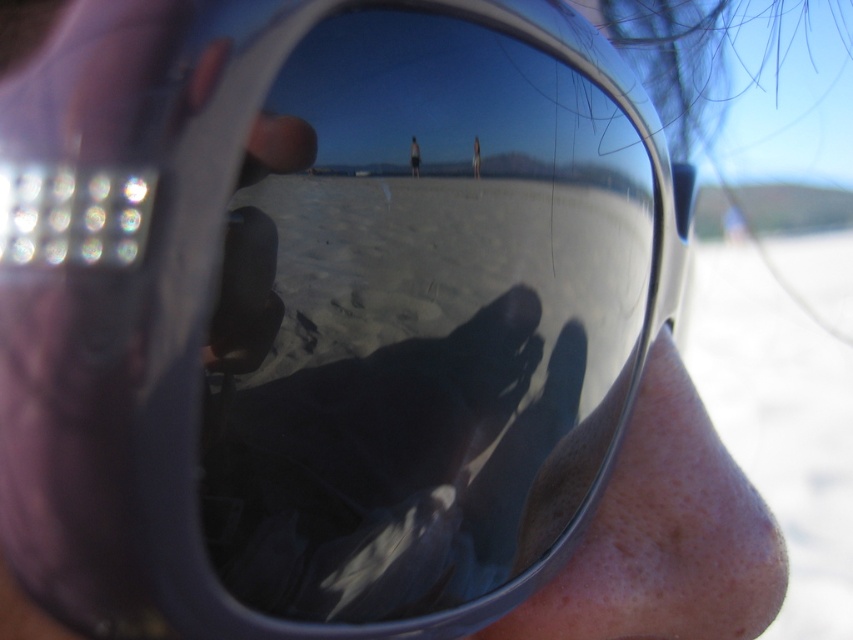
You are a photographer trying to capture the reflection of the beach in the sunglasses. The white sand at lower right is represented by point (779, 420). Where should you aim your camera to ensure the reflection of the white sand at lower right is visible in the sunglasses?

To capture the reflection of the white sand at lower right, aim your camera towards the point (779, 420) where the white sand is represented in the reflection.

You are a photographer trying to capture the reflection in the sunglasses. You notice a point marked at coordinates point (x=779, y=420). Based on the scene, where is this point located in relation to the beach and the two figures?

The point (x=779, y=420) is on white sand at lower right, which is near the edge of the beach closest to the waterline where one of the figures is standing.